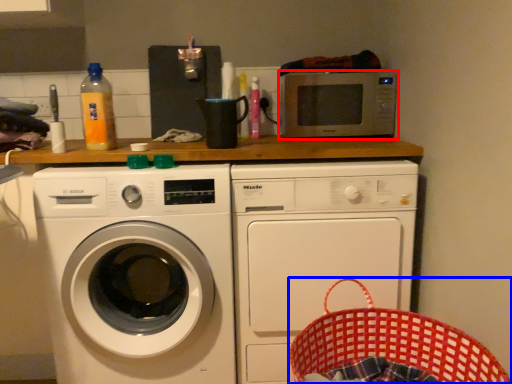
Question: Which point is closer to the camera, microwave oven (highlighted by a red box) or basket (highlighted by a blue box)?

Choices:
 (A) microwave oven
 (B) basket

Answer: (B)